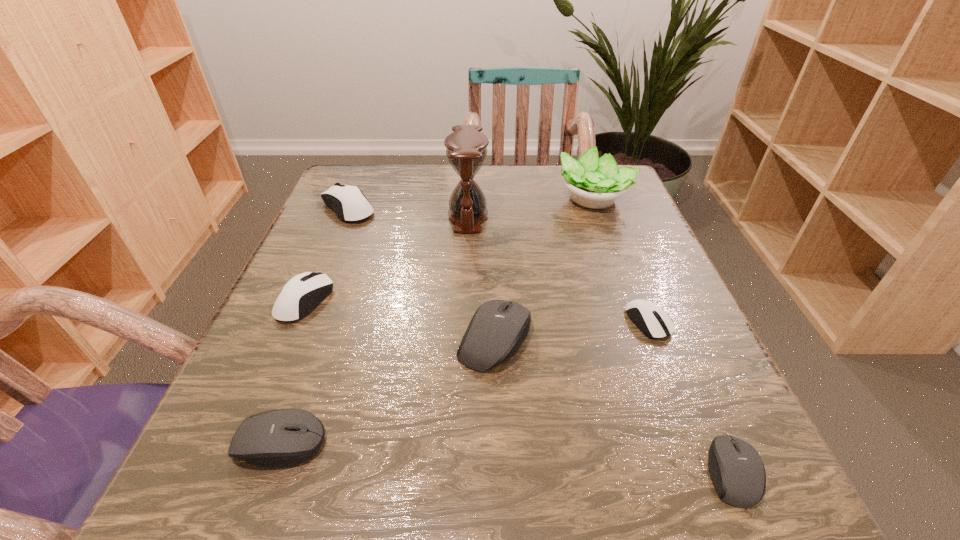
At what (x,y) coordinates should I click in order to perform the action: click on vacant point located between the farthest computer equipment and the hourglass. Please return your answer as a coordinate pair (x, y). The height and width of the screenshot is (540, 960). Looking at the image, I should click on (408, 212).

Find the location of a particular element. blank region between the tallest object and the farthest black computer equipment is located at coordinates (481, 276).

This screenshot has width=960, height=540. In order to click on vacant space that's between the green lettuce and the brown hourglass in this screenshot , I will do `click(531, 207)`.

I want to click on the second closest object to the brown hourglass, so click(x=348, y=202).

The height and width of the screenshot is (540, 960). I want to click on object that is the third closest to the leftmost black computer equipment, so click(x=466, y=148).

This screenshot has height=540, width=960. Find the location of `computer equipment that is the third closest to the second black computer equipment from right to left`. computer equipment that is the third closest to the second black computer equipment from right to left is located at coordinates (736, 469).

At what (x,y) coordinates should I click in order to perform the action: click on the fourth closest computer equipment relative to the smallest white mouse. Please return your answer as a coordinate pair (x, y). This screenshot has width=960, height=540. Looking at the image, I should click on (302, 293).

Where is `the closest white mouse to the lettuce`? This screenshot has height=540, width=960. the closest white mouse to the lettuce is located at coordinates (x=654, y=322).

The image size is (960, 540). In order to click on the second closest white mouse to the smallest white mouse in this screenshot , I will do `click(348, 202)`.

I want to click on black computer equipment that is the second nearest to the smallest black computer equipment, so click(x=284, y=437).